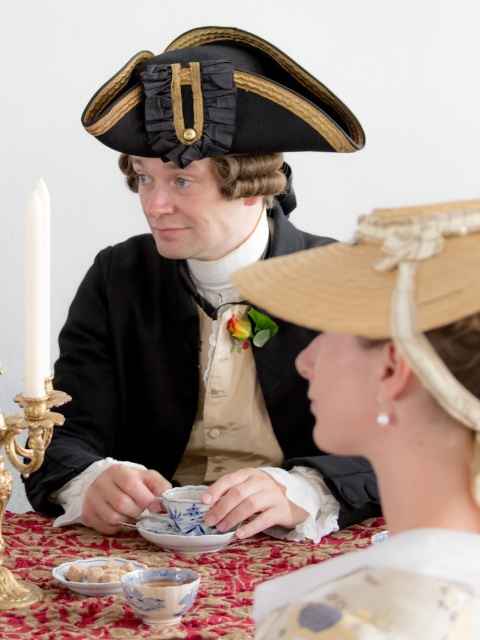
Question: Which of the following is the farthest from the observer?

Choices:
 (A) gold ornate candlestick at left
 (B) matte black hat at center

Answer: (B)

Question: Which of the following is the farthest from the observer?

Choices:
 (A) gold ornate candlestick at left
 (B) white glossy dumplings at lower left
 (C) white porcelain bowl at lower center
 (D) matte black hat at center

Answer: (D)

Question: In this image, where is matte black hat at center located relative to white porcelain bowl at lower center?

Choices:
 (A) right
 (B) left

Answer: (A)

Question: Does natural straw hat at center have a smaller size compared to porcelain plate at center?

Choices:
 (A) yes
 (B) no

Answer: (A)

Question: Which object is closer to the camera taking this photo?

Choices:
 (A) gold ornate candlestick at left
 (B) porcelain plate at center
 (C) matte black hat at center
 (D) black straw hat at upper center

Answer: (B)

Question: Does matte black hat at center come behind gold ornate candlestick at left?

Choices:
 (A) yes
 (B) no

Answer: (A)